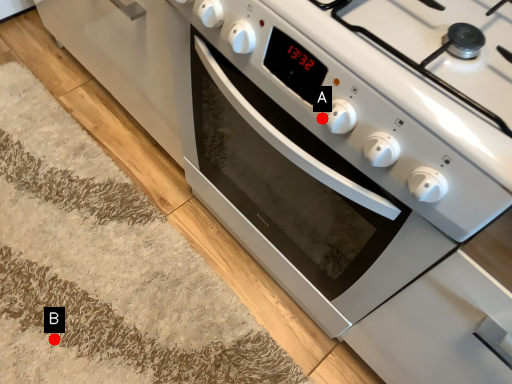
Question: Two points are circled on the image, labeled by A and B beside each circle. Among these points, which one is farthest from the camera?

Choices:
 (A) A is further
 (B) B is further

Answer: (B)